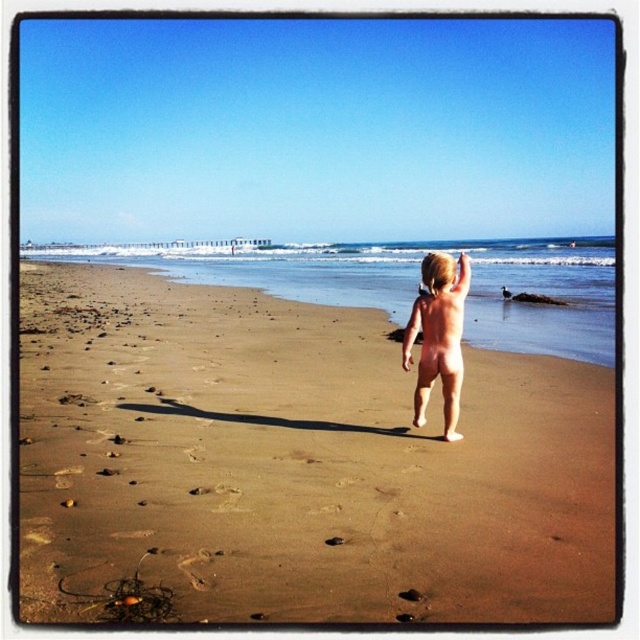
You are a lifeguard on duty and notice a child at the edge of the brown sandy beach at center. The child is standing near the nude skin at center. If the safe distance for a child to be from the water is 3 meters, is the child currently within the safe zone?

The distance between the brown sandy beach at center and the nude skin at center is 2.43 meters. Since the safe distance is 3 meters, the child is within the safe zone as they are closer than the required distance.